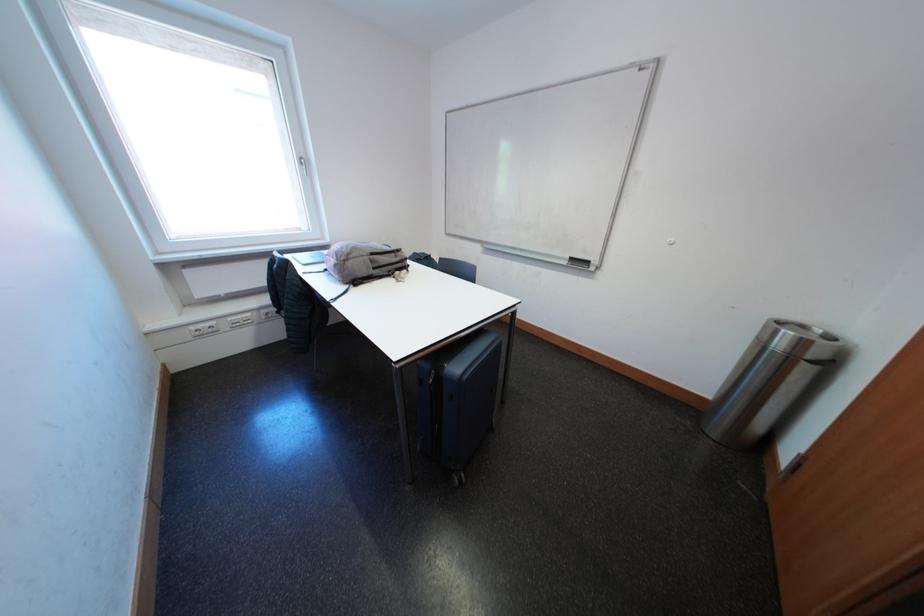
Find the location of a particular element. This screenshot has width=924, height=616. white window handle is located at coordinates (305, 169).